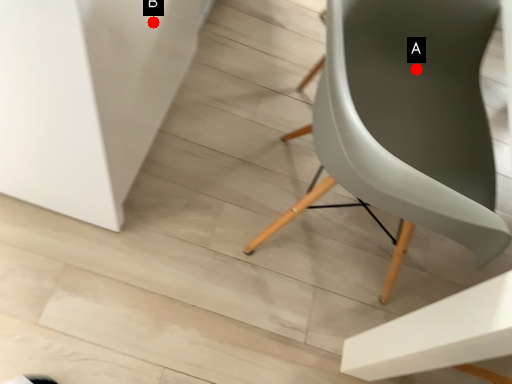
Question: Two points are circled on the image, labeled by A and B beside each circle. Which point is farther to the camera?

Choices:
 (A) A is further
 (B) B is further

Answer: (A)